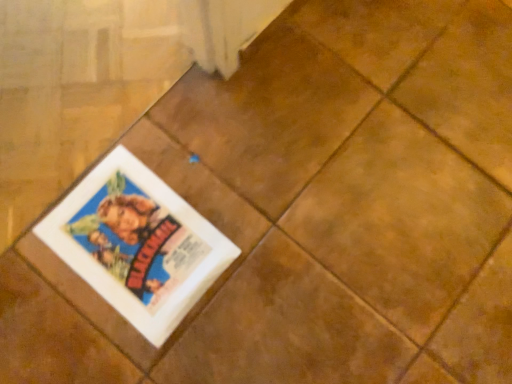
The height and width of the screenshot is (384, 512). I want to click on white paper magazine at center, so click(x=137, y=244).

Measure the distance between point [208,227] and camera.

Point [208,227] is 76.60 centimeters from camera.

What do you see at coordinates (137, 244) in the screenshot? The image size is (512, 384). I see `white paper magazine at center` at bounding box center [137, 244].

You are a GUI agent. You are given a task and a screenshot of the screen. Output one action in this format:
    pyautogui.click(x=<x>, y=<y>)
    Task: Click on the white paper magazine at center
    The image size is (512, 384).
    Given the screenshot: What is the action you would take?
    pyautogui.click(x=137, y=244)